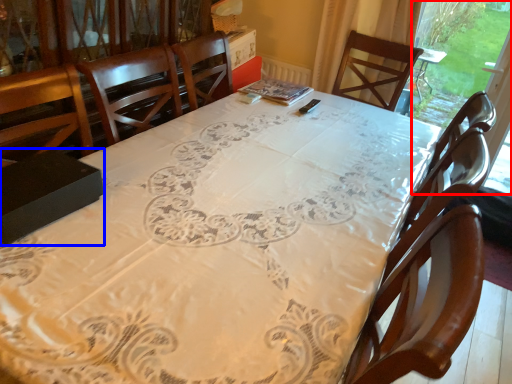
Question: Which object appears farthest to the camera in this image, window screen (highlighted by a red box) or box (highlighted by a blue box)?

Choices:
 (A) window screen
 (B) box

Answer: (A)